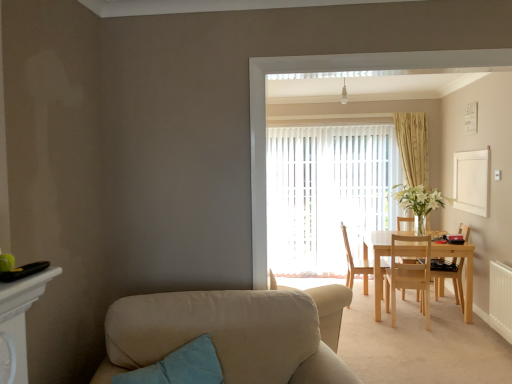
Find the location of a particular element. The image size is (512, 384). free area below light wood chair at center, which is the second chair from left to right (from a real-world perspective) is located at coordinates (413, 324).